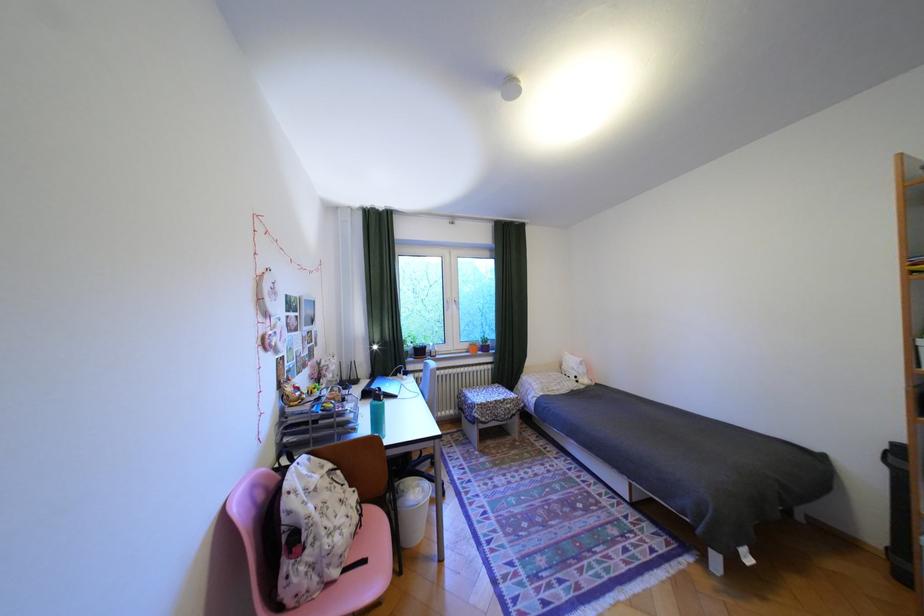
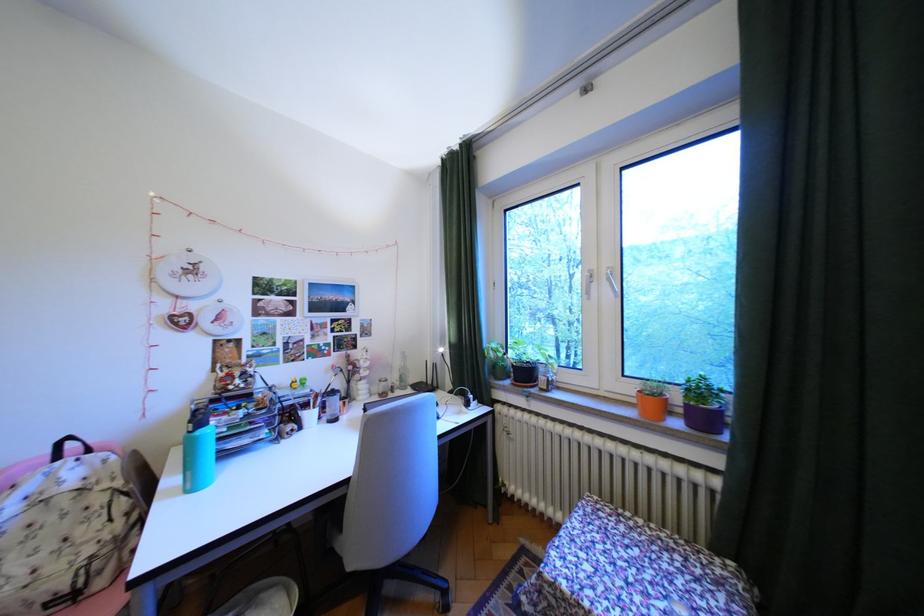
Where in the second image is the point corresponding to (496,341) from the first image?

(710, 391)